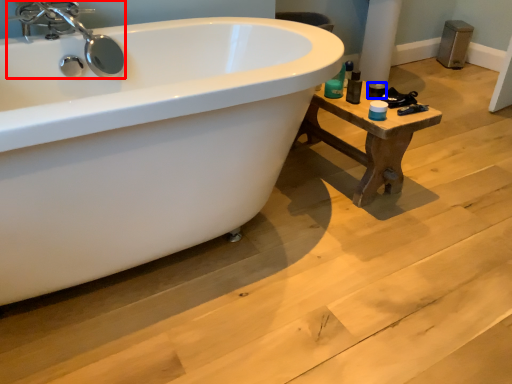
Question: Among these objects, which one is nearest to the camera, tap (highlighted by a red box) or toiletry (highlighted by a blue box)?

Choices:
 (A) tap
 (B) toiletry

Answer: (A)